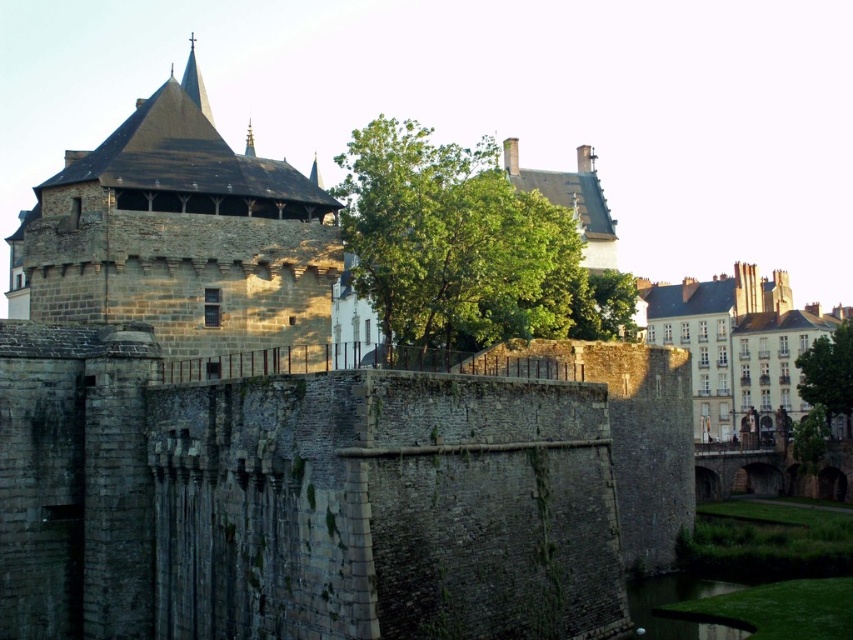
Question: Does green grassy bank at lower right lie in front of green leafy tree at upper center?

Choices:
 (A) no
 (B) yes

Answer: (B)

Question: Which point is closer to the camera?

Choices:
 (A) green grassy bank at lower right
 (B) green leafy tree at upper center
 (C) green leafy tree at lower right
 (D) green leafy tree at center

Answer: (A)

Question: Does green grassy bank at lower right have a larger size compared to green leafy tree at lower right?

Choices:
 (A) no
 (B) yes

Answer: (A)

Question: Based on their relative distances, which object is nearer to the green leafy tree at lower right?

Choices:
 (A) green grassy bank at lower right
 (B) green leafy tree at upper center
 (C) green leafy tree at center

Answer: (B)

Question: Can you confirm if green leafy tree at center is positioned to the left of green grassy bank at lower right?

Choices:
 (A) yes
 (B) no

Answer: (A)

Question: Among these points, which one is farthest from the camera?

Choices:
 (A) (607, 330)
 (B) (650, 612)
 (C) (815, 355)

Answer: (C)